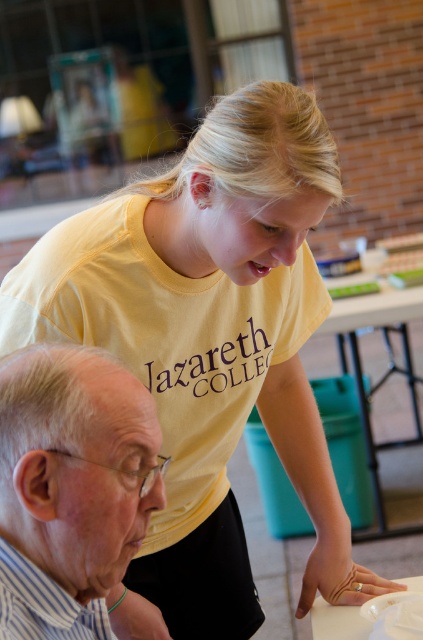
You are a service robot with a width of 20 inches. You need to move from the white striped fabric at lower left to the white glossy table at lower center. Can you pass through the space between them without touching either?

The distance between the white striped fabric at lower left and the white glossy table at lower center is 23.00 inches. Since the robot is 20 inches wide, it can pass through the space between them without touching either.

You are standing at the entrance of the room and want to find the green plastic table at center. According to the coordinates provided, in which direction should you move to reach it?

The green plastic table at center is located at coordinates point (381,376). Since the coordinate system typically has (0,0) at the bottom left corner, moving towards the upper right direction from the entrance would lead you to the table.